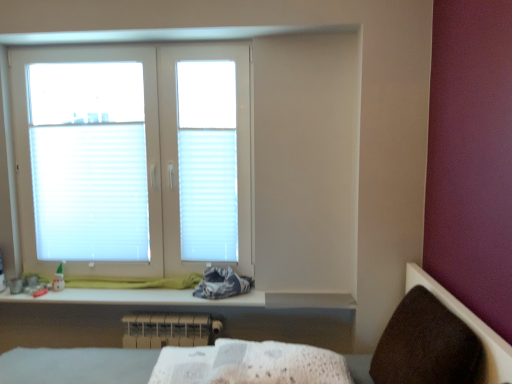
Find the location of a particular element. The width and height of the screenshot is (512, 384). free spot above white plastic window at upper left (from a real-world perspective) is located at coordinates (141, 45).